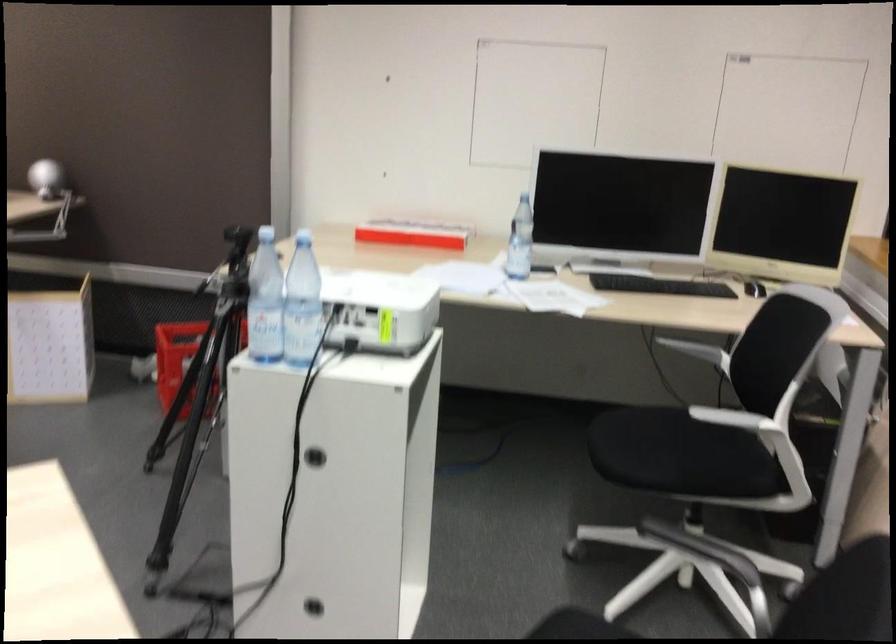
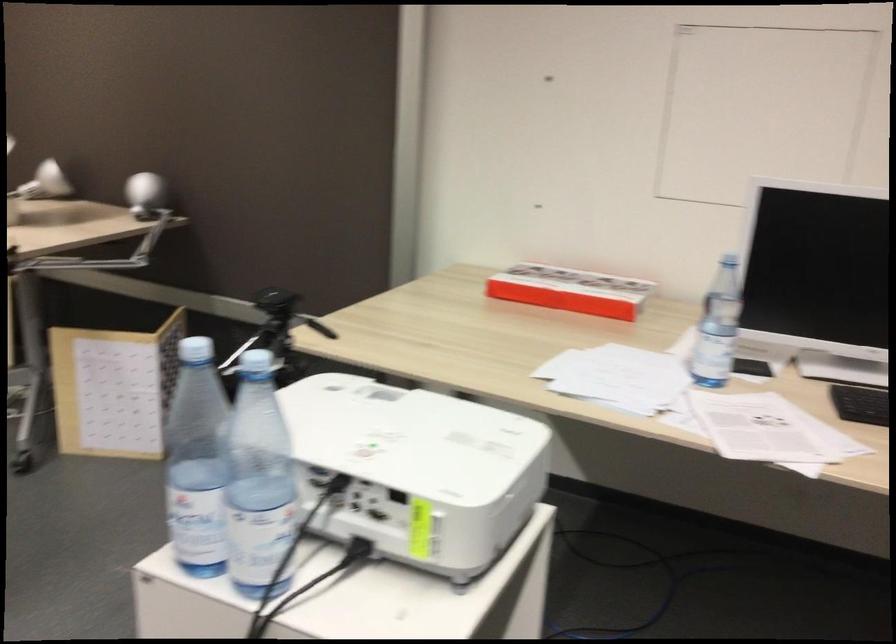
Find the pixel in the second image that matches pixel 517 242 in the first image.

(718, 327)